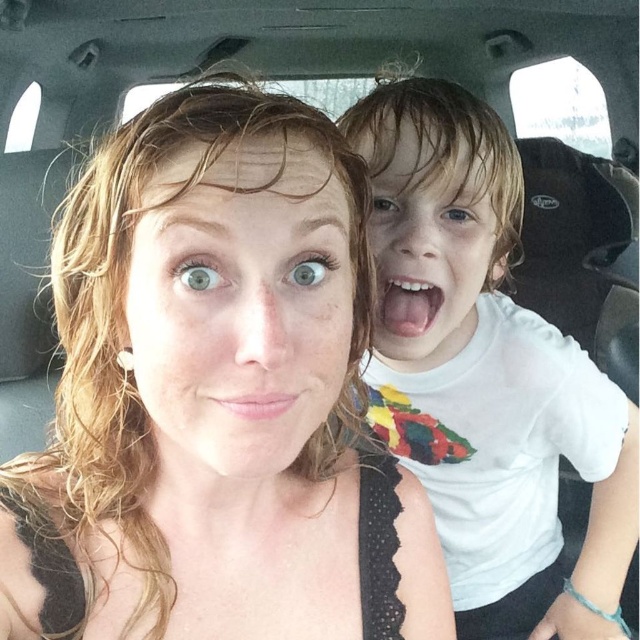
You are a photographer trying to focus on the matte black tank top at center in the image. What coordinates should you adjust your camera to aim for?

The matte black tank top at center is located at coordinates point (216,396).